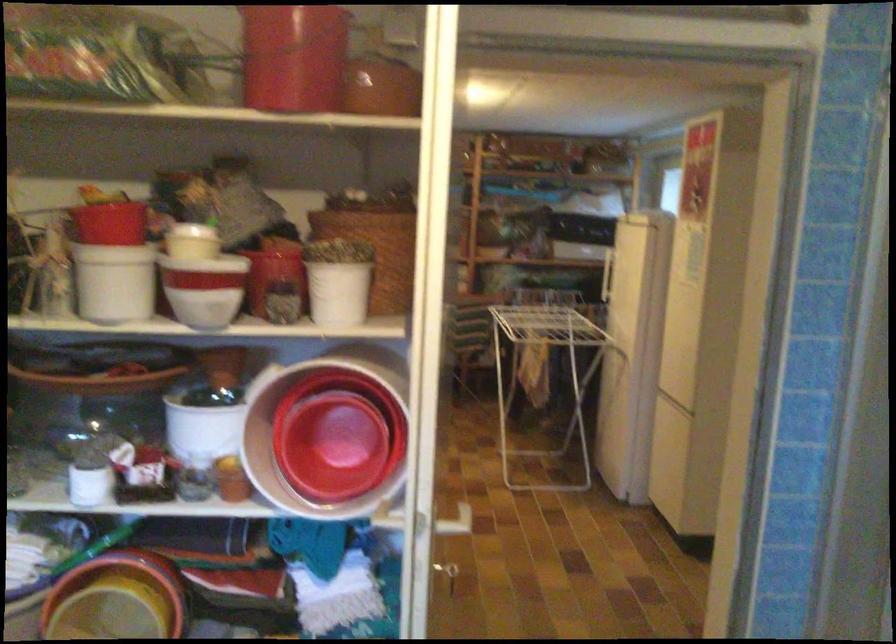
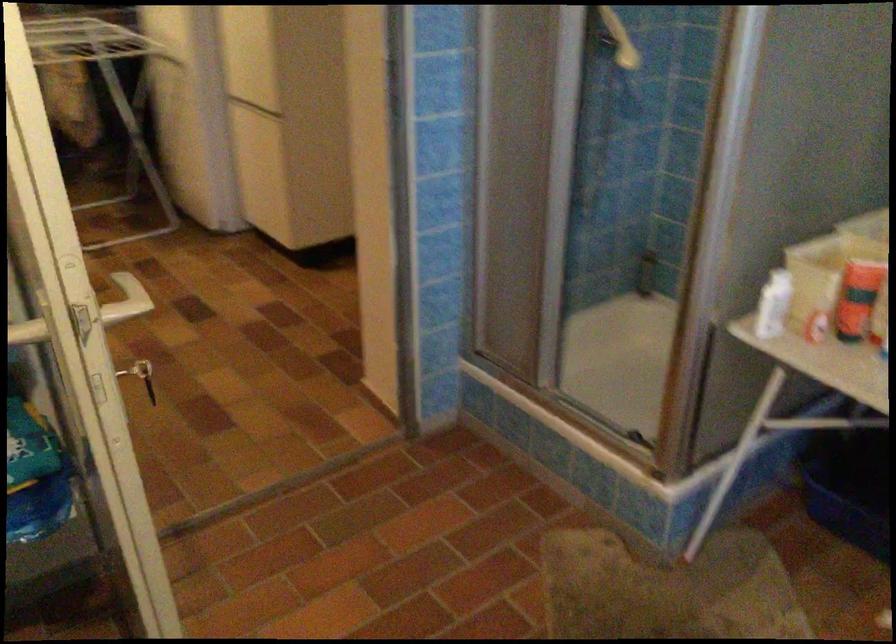
How did the camera likely rotate?

The rotation direction of the camera is right-down.